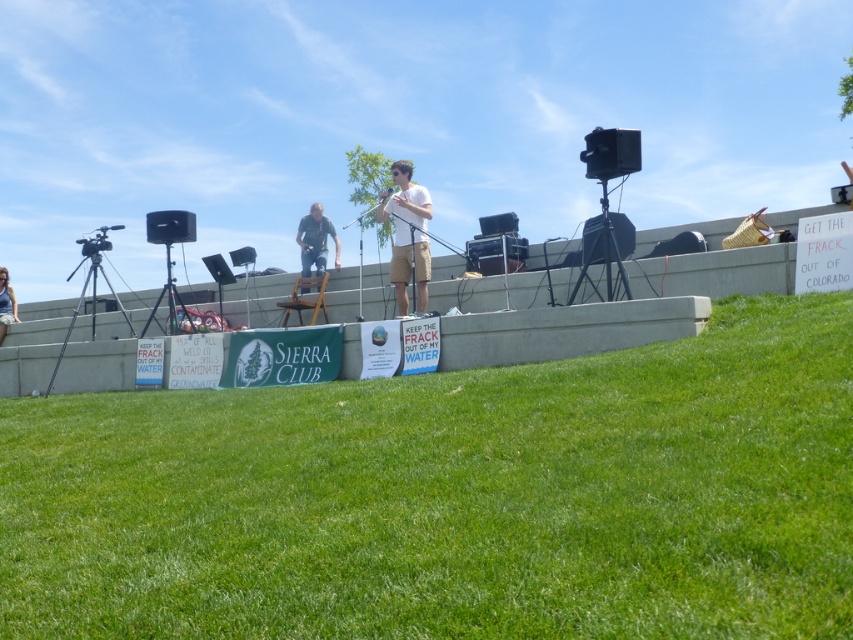
Does black matte tripod at left have a smaller size compared to denim jacket at lower left?

Correct, black matte tripod at left occupies less space than denim jacket at lower left.

Which is in front, point (175, 301) or point (1, 324)?

Point (175, 301)

Is point (163, 284) behind point (9, 316)?

No, it is not.

Find the location of a particular element. The image size is (853, 640). black matte tripod at left is located at coordinates (167, 298).

Is the position of green grassy at lower center more distant than that of black metal tripod at left?

No, it is in front of black metal tripod at left.

Identify the location of green grassy at lower center. This screenshot has width=853, height=640. (453, 497).

Is white cotton shirt at center thinner than black matte tripod at right?

In fact, white cotton shirt at center might be wider than black matte tripod at right.

Is point (412, 236) more distant than point (627, 282)?

Yes, it is behind point (627, 282).

Find the location of a particular element. The width and height of the screenshot is (853, 640). white cotton shirt at center is located at coordinates (407, 234).